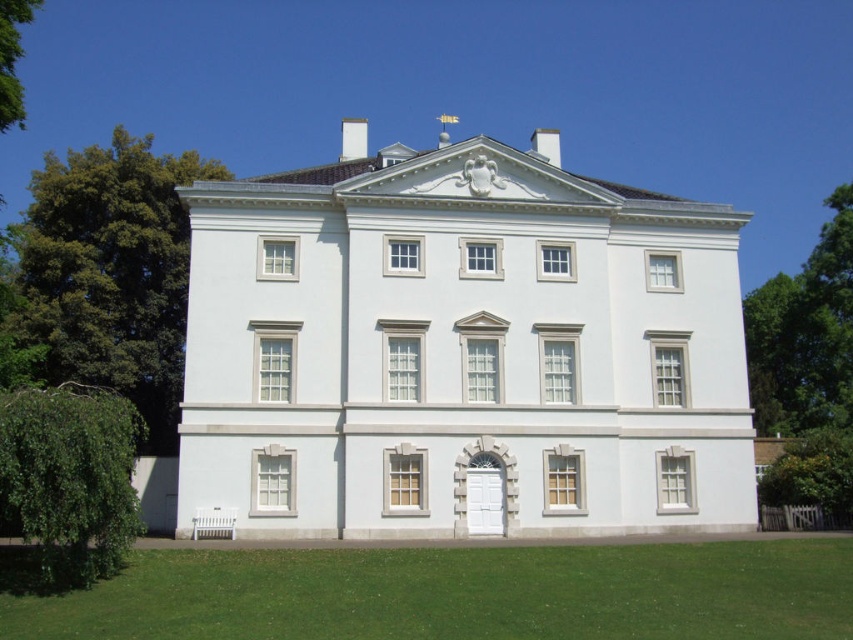
Which is behind, point (708, 577) or point (131, 433)?

Point (708, 577)

Can you confirm if green grass at lower center is taller than green leafy tree at lower left?

No.

The image size is (853, 640). What are the coordinates of `green grass at lower center` in the screenshot? It's located at (x=450, y=593).

Between point (692, 355) and point (837, 356), which one is positioned behind?

The point (837, 356) is more distant.

You are a GUI agent. You are given a task and a screenshot of the screen. Output one action in this format:
    pyautogui.click(x=<x>, y=<y>)
    Task: Click on the white smooth building at center
    
    Given the screenshot: What is the action you would take?
    pyautogui.click(x=461, y=349)

Does green grass at lower center have a larger size compared to green leafy tree at right?

No, green grass at lower center is not bigger than green leafy tree at right.

You are a GUI agent. You are given a task and a screenshot of the screen. Output one action in this format:
    pyautogui.click(x=<x>, y=<y>)
    Task: Click on the green grass at lower center
    This screenshot has height=640, width=853.
    Given the screenshot: What is the action you would take?
    pyautogui.click(x=450, y=593)